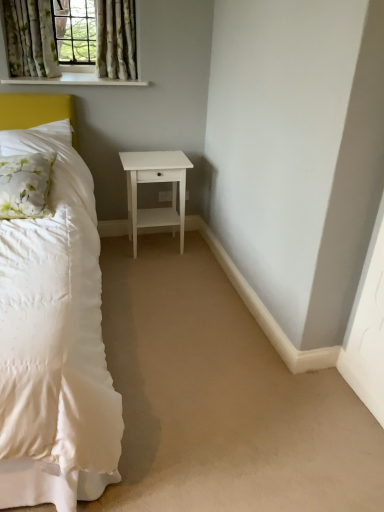
At what (x,y) coordinates should I click in order to perform the action: click on white painted wood at upper left. Please return your answer as a coordinate pair (x, y). The image size is (384, 512). Looking at the image, I should click on (76, 80).

At what (x,y) coordinates should I click in order to perform the action: click on white matte nightstand at center. Please return your answer as a coordinate pair (x, y). The image size is (384, 512). Looking at the image, I should click on (155, 182).

Measure the distance between floral fabric curtain at upper left and camera.

floral fabric curtain at upper left is 2.66 meters from camera.

In order to click on floral fabric curtain at upper left, the 1th curtain in the right-to-left sequence in this screenshot , I will do `click(116, 39)`.

Which is in front, point (71, 83) or point (164, 201)?

The point (71, 83) is closer to the camera.

Can you confirm if white painted wood at upper left is thinner than white plastic electric outlet at center?

In fact, white painted wood at upper left might be wider than white plastic electric outlet at center.

Is white painted wood at upper left next to white plastic electric outlet at center and touching it?

white painted wood at upper left and white plastic electric outlet at center are clearly separated.

Considering the positions of objects floral fabric curtain at upper left, which is the 2th curtain in left-to-right order, and white floral fabric pillow at left in the image provided, who is behind, floral fabric curtain at upper left, which is the 2th curtain in left-to-right order, or white floral fabric pillow at left?

floral fabric curtain at upper left, which is the 2th curtain in left-to-right order, is more distant.

Who is smaller, floral fabric curtain at upper left, which is the 2th curtain in left-to-right order, or white floral fabric pillow at left?

Smaller between the two is floral fabric curtain at upper left, which is the 2th curtain in left-to-right order.

From a real-world perspective, between floral fabric curtain at upper left, the 1th curtain in the right-to-left sequence, and white floral fabric pillow at left, who is vertically lower?

white floral fabric pillow at left is physically lower.

Is floral fabric curtain at upper left, which is the 1th curtain from left to right, bigger than white matte nightstand at center?

No, floral fabric curtain at upper left, which is the 1th curtain from left to right, is not bigger than white matte nightstand at center.

Is floral fabric curtain at upper left, which is the 1th curtain from left to right, positioned with its back to white matte nightstand at center?

A: No, floral fabric curtain at upper left, which is the 1th curtain from left to right, is not facing away from white matte nightstand at center.

Locate an element on the screen. nightstand on the right side of floral fabric curtain at upper left, which is the 1th curtain from left to right is located at coordinates (155, 182).

From a real-world perspective, between floral fabric curtain at upper left, the second curtain positioned from the right, and white matte nightstand at center, who is vertically higher?

floral fabric curtain at upper left, the second curtain positioned from the right, is physically above.

Which object is more forward, white plastic electric outlet at center or white floral fabric pillow at left?

white floral fabric pillow at left.

Measure the distance between white plastic electric outlet at center and white floral fabric pillow at left.

A distance of 4.11 feet exists between white plastic electric outlet at center and white floral fabric pillow at left.

From a real-world perspective, relative to white floral fabric pillow at left, is white plastic electric outlet at center vertically above or below?

From a real-world perspective, white plastic electric outlet at center is physically below white floral fabric pillow at left.

Considering the sizes of objects white plastic electric outlet at center and floral fabric curtain at upper left, the 1th curtain in the right-to-left sequence, in the image provided, who is taller, white plastic electric outlet at center or floral fabric curtain at upper left, the 1th curtain in the right-to-left sequence,?

floral fabric curtain at upper left, the 1th curtain in the right-to-left sequence.

Is white plastic electric outlet at center in contact with floral fabric curtain at upper left, which is the 2th curtain in left-to-right order?

No, white plastic electric outlet at center is not touching floral fabric curtain at upper left, which is the 2th curtain in left-to-right order.

Considering the sizes of objects white plastic electric outlet at center and floral fabric curtain at upper left, which is the 2th curtain in left-to-right order, in the image provided, who is thinner, white plastic electric outlet at center or floral fabric curtain at upper left, which is the 2th curtain in left-to-right order,?

white plastic electric outlet at center.

Is white matte nightstand at center wider or thinner than floral fabric curtain at upper left?

Clearly, white matte nightstand at center has more width compared to floral fabric curtain at upper left.

Identify the location of nightstand below the floral fabric curtain at upper left (from the image's perspective). The width and height of the screenshot is (384, 512). (155, 182).

Can you confirm if white matte nightstand at center is taller than floral fabric curtain at upper left?

Yes.

From the image's perspective, is white matte nightstand at center on floral fabric curtain at upper left?

No, from the image's perspective, white matte nightstand at center is not over floral fabric curtain at upper left.

How many degrees apart are the facing directions of white floral fabric pillow at left and floral fabric curtain at upper left, which is the 2th curtain in left-to-right order?

There is a 5.31-degree angle between the facing directions of white floral fabric pillow at left and floral fabric curtain at upper left, which is the 2th curtain in left-to-right order.

Which object is positioned more to the right, white floral fabric pillow at left or floral fabric curtain at upper left, which is the 2th curtain in left-to-right order?

From the viewer's perspective, floral fabric curtain at upper left, which is the 2th curtain in left-to-right order, appears more on the right side.

Which of these two, white floral fabric pillow at left or floral fabric curtain at upper left, the 1th curtain in the right-to-left sequence, is smaller?

floral fabric curtain at upper left, the 1th curtain in the right-to-left sequence.

From a real-world perspective, which is physically above, white floral fabric pillow at left or floral fabric curtain at upper left, which is the 2th curtain in left-to-right order?

floral fabric curtain at upper left, which is the 2th curtain in left-to-right order, is physically above.

Identify the location of electric outlet that appears below the white painted wood at upper left (from a real-world perspective). This screenshot has width=384, height=512. (165, 196).

The image size is (384, 512). I want to click on curtain that is the 2nd one when counting upward from the white floral fabric pillow at left (from the image's perspective), so click(116, 39).

From the picture: Based on their spatial positions, is floral fabric curtain at upper left or floral fabric curtain at upper left, which is the 1th curtain from left to right, closer to white painted wood at upper left?

Among the two, floral fabric curtain at upper left is located nearer to white painted wood at upper left.

Estimate the real-world distances between objects in this image. Which object is further from white painted wood at upper left, white matte nightstand at center or white plastic electric outlet at center?

white plastic electric outlet at center is positioned further to the anchor white painted wood at upper left.

Estimate the real-world distances between objects in this image. Which object is further from floral fabric curtain at upper left, which is the 1th curtain from left to right, floral fabric curtain at upper left or white painted wood at upper left?

white painted wood at upper left is positioned further to the anchor floral fabric curtain at upper left, which is the 1th curtain from left to right.

When comparing their distances from floral fabric curtain at upper left, which is the 1th curtain from left to right, does white painted wood at upper left or white floral fabric pillow at left seem closer?

white painted wood at upper left.

Based on their spatial positions, is white floral fabric pillow at left or floral fabric curtain at upper left, which is the 2th curtain in left-to-right order, closer to white matte nightstand at center?

Result: floral fabric curtain at upper left, which is the 2th curtain in left-to-right order, lies closer to white matte nightstand at center than the other object.

From the image, which object appears to be nearer to white painted wood at upper left, floral fabric curtain at upper left, which is the 2th curtain in left-to-right order, or floral fabric curtain at upper left, which is the 1th curtain from left to right?

Based on the image, floral fabric curtain at upper left, which is the 1th curtain from left to right, appears to be nearer to white painted wood at upper left.

From the image, which object appears to be nearer to floral fabric curtain at upper left, which is the 1th curtain from left to right, white matte nightstand at center or floral fabric curtain at upper left, which is the 2th curtain in left-to-right order?

Among the two, floral fabric curtain at upper left, which is the 2th curtain in left-to-right order, is located nearer to floral fabric curtain at upper left, which is the 1th curtain from left to right.

Which object lies nearer to the anchor point white floral fabric pillow at left, floral fabric curtain at upper left, which is the 1th curtain from left to right, or floral fabric curtain at upper left?

floral fabric curtain at upper left is closer to white floral fabric pillow at left.

The image size is (384, 512). Identify the location of window sill that lies between floral fabric curtain at upper left, which is the 2th curtain in left-to-right order, and white plastic electric outlet at center from top to bottom. (76, 80).

Locate an element on the screen. pillow that lies between floral fabric curtain at upper left and white matte nightstand at center from top to bottom is located at coordinates (25, 185).

Locate an element on the screen. The image size is (384, 512). nightstand between white floral fabric pillow at left and white plastic electric outlet at center along the z-axis is located at coordinates (155, 182).

Locate an element on the screen. This screenshot has height=512, width=384. window sill between floral fabric curtain at upper left, which is the 1th curtain from left to right, and floral fabric curtain at upper left, the 1th curtain in the right-to-left sequence is located at coordinates (76, 80).